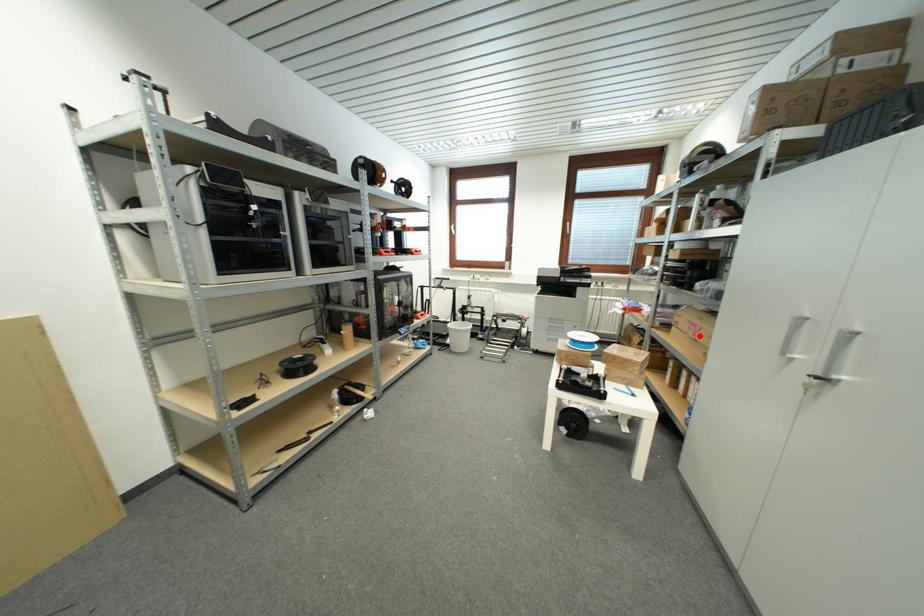
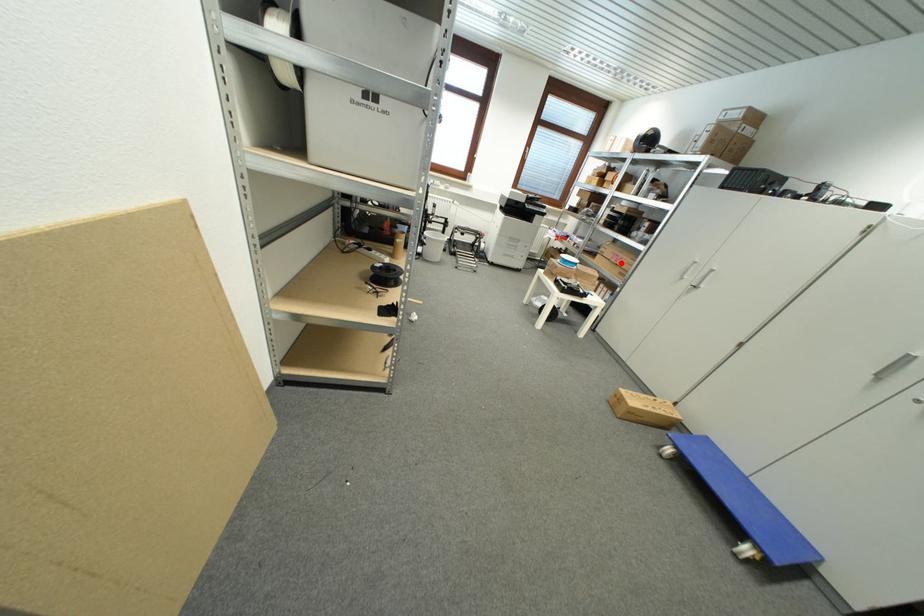
I am providing you with two images of the same scene from different viewpoints. A red point is marked on the first image and another point is marked on the second image. Is the red point in image1 aligned with the point shown in image2?

Yes